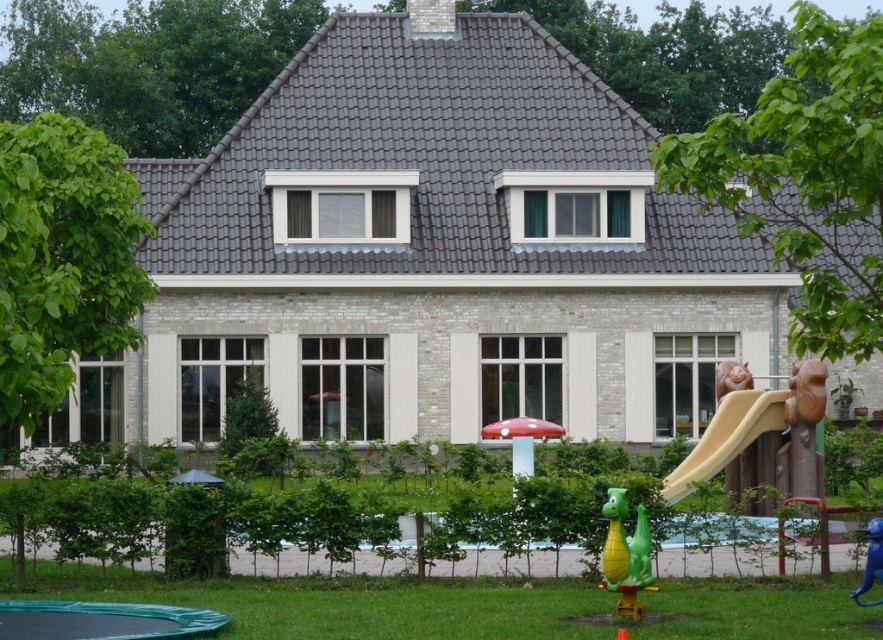
You are a parent supervising children playing in the backyard. You see the smooth beige slide at right and the blue plastic monkey at lower right. Which object is closer to the house?

The smooth beige slide at right is positioned over the blue plastic monkey at lower right, meaning the slide is closer to the house than the monkey.

You are standing at the center of the lawn in front of the house. You want to go to the smooth beige slide at right. Which direction should you walk? Please answer with either left, right, forward, or backward.

You should walk to the right to reach the smooth beige slide at right since it is located at the right side of the house.

You are a parent trying to ensure your child can play safely on the trampoline in the bottom left corner. There are two toys nearby, the green rubber dragon at lower right and the blue plastic monkey at lower right. Which toy is closer to the trampoline?

The blue plastic monkey at lower right is closer to the trampoline in the bottom left corner than the green rubber dragon at lower right.